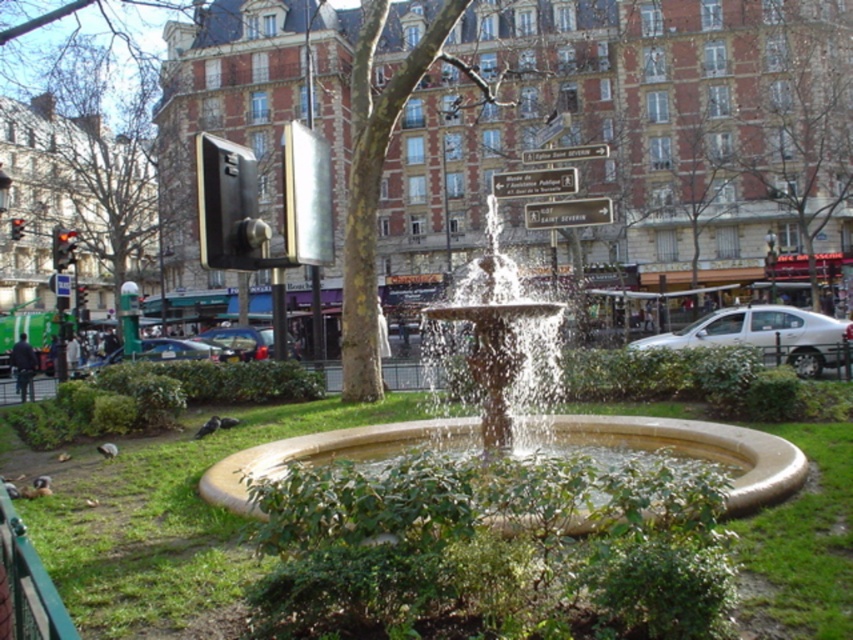
You are standing in the urban park scene with the fountain. You see two points marked as point 1 and point 2. Point 1 is at coordinate point [86,58] and point 2 is at coordinate point [808,275]. If you want to place a small bench between these two points, which point should the bench be closer to so that it is nearer to the camera?

The bench should be placed closer to point [86,58] because it is further to the camera than point [808,275]. This ensures the bench remains closer to the viewer.

You are standing at the entrance of the park and want to walk towards the fountain. There is green grass at center and a brown textured tree at center in your path. Which object should you avoid stepping on to stay on the path?

You should avoid stepping on the green grass at center, as it is to the left of the brown textured tree at center and likely part of the designated path around the fountain.